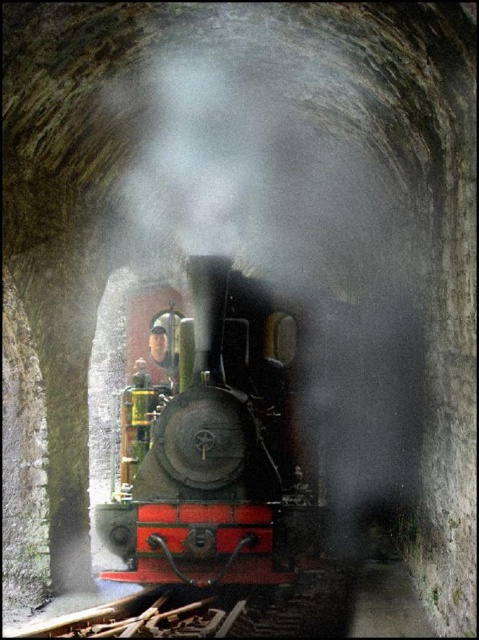
You are standing at the entrance of the tunnel and see two points marked in the image. Which point is closer to you, the point at coordinates point (138, 572) or the point at coordinates point (155, 349)?

Point (138, 572) is in front of point (155, 349), so the point at coordinates point (138, 572) is closer to you.

You are a photographer trying to capture the polished brass steam engine at center and the green fabric conductor at center in a single frame. Since you want to emphasize the steam engine, which object should you focus on first and why?

You should focus on the polished brass steam engine at center first because it is larger in size compared to the green fabric conductor at center, making it the primary subject for emphasis.